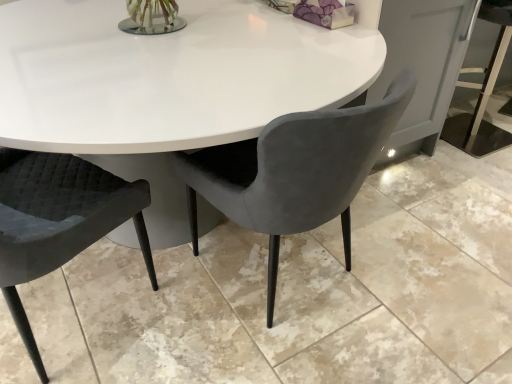
You are a GUI agent. You are given a task and a screenshot of the screen. Output one action in this format:
    pyautogui.click(x=<x>, y=<y>)
    Task: Click on the free point below velvet grey chair at center, acting as the second chair starting from the left (from a real-world perspective)
    
    Given the screenshot: What is the action you would take?
    pyautogui.click(x=287, y=281)